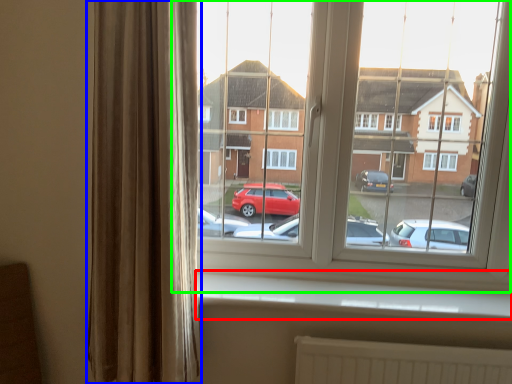
Question: Based on their relative distances, which object is farther from window sill (highlighted by a red box)? Choose from curtain (highlighted by a blue box) and window (highlighted by a green box).

Choices:
 (A) curtain
 (B) window

Answer: (A)